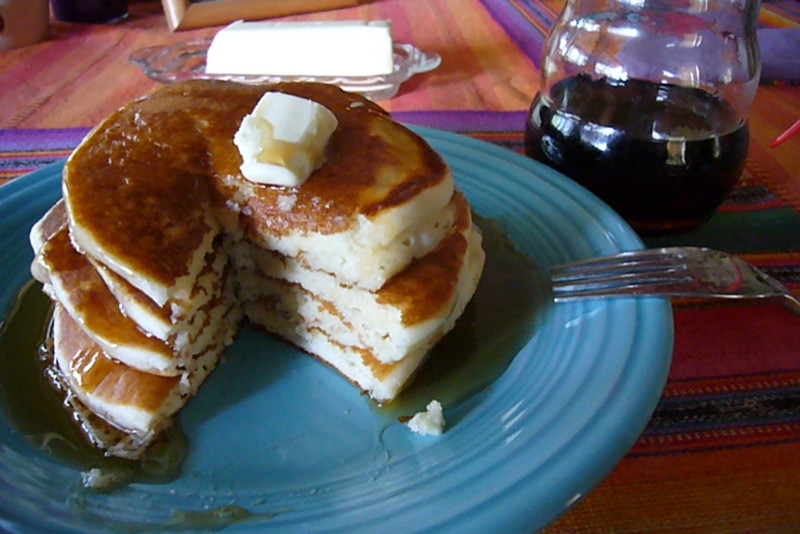
I want to click on fork, so click(654, 270).